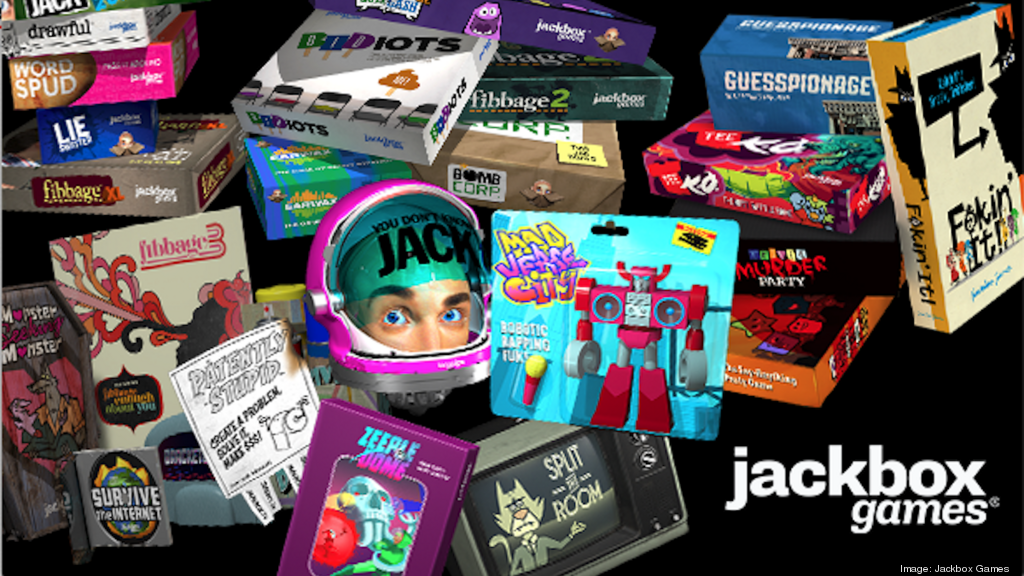
The width and height of the screenshot is (1024, 576). Identify the location of small knobs with silver caps on the lower right side of the television. (657, 525), (675, 517).